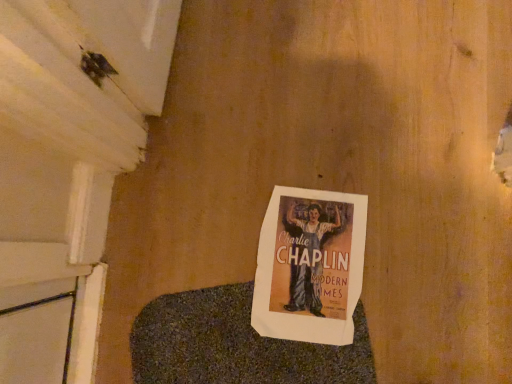
Image resolution: width=512 pixels, height=384 pixels. Describe the element at coordinates (310, 266) in the screenshot. I see `matte paper poster at center` at that location.

I want to click on matte paper poster at center, so click(310, 266).

In order to click on blue textured blanket at center in this screenshot , I will do `click(234, 345)`.

From the picture: In order to face blue textured blanket at center, should I rotate leftwards or rightwards?

To align with it, rotate left about 1.025°.

Describe the element at coordinates (234, 345) in the screenshot. I see `blue textured blanket at center` at that location.

Find the location of a particular element. This screenshot has width=512, height=384. matte paper poster at center is located at coordinates (310, 266).

Which is more to the left, blue textured blanket at center or matte paper poster at center?

blue textured blanket at center is more to the left.

Considering the positions of objects blue textured blanket at center and matte paper poster at center in the image provided, who is behind, blue textured blanket at center or matte paper poster at center?

matte paper poster at center.

Considering the points (269, 339) and (352, 268), which point is behind, point (269, 339) or point (352, 268)?

Positioned behind is point (352, 268).

From the image's perspective, between blue textured blanket at center and matte paper poster at center, who is located below?

blue textured blanket at center appears lower in the image.

From a real-world perspective, does blue textured blanket at center stand above matte paper poster at center?

Yes, from a real-world perspective, blue textured blanket at center is over matte paper poster at center

Based on the photo, considering the relative sizes of blue textured blanket at center and matte paper poster at center in the image provided, is blue textured blanket at center thinner than matte paper poster at center?

No, blue textured blanket at center is not thinner than matte paper poster at center.

From their relative heights in the image, would you say blue textured blanket at center is taller or shorter than matte paper poster at center?

blue textured blanket at center is taller than matte paper poster at center.

Can you confirm if blue textured blanket at center is bigger than matte paper poster at center?

Correct, blue textured blanket at center is larger in size than matte paper poster at center.

Is blue textured blanket at center not inside matte paper poster at center?

blue textured blanket at center is positioned outside matte paper poster at center.

Are blue textured blanket at center and matte paper poster at center located far from each other?

They are positioned close to each other.

Could you tell me if blue textured blanket at center is turned towards matte paper poster at center?

No, blue textured blanket at center does not turn towards matte paper poster at center.

Locate an element on the screen. Image resolution: width=512 pixels, height=384 pixels. blanket on the left side of matte paper poster at center is located at coordinates (234, 345).

Can you confirm if matte paper poster at center is positioned to the left of blue textured blanket at center?

Incorrect, matte paper poster at center is not on the left side of blue textured blanket at center.

Is matte paper poster at center closer to the viewer compared to blue textured blanket at center?

No, matte paper poster at center is behind blue textured blanket at center.

Is point (340, 340) closer or farther from the camera than point (236, 341)?

Point (340, 340) appears to be closer to the viewer than point (236, 341).

From the image's perspective, which is above, matte paper poster at center or blue textured blanket at center?

matte paper poster at center appears higher in the image.

From a real-world perspective, between matte paper poster at center and blue textured blanket at center, who is vertically lower?

In real-world perspective, matte paper poster at center is lower.

Considering the sizes of objects matte paper poster at center and blue textured blanket at center in the image provided, who is thinner, matte paper poster at center or blue textured blanket at center?

matte paper poster at center is thinner.

In terms of height, does matte paper poster at center look taller or shorter compared to blue textured blanket at center?

matte paper poster at center is shorter than blue textured blanket at center.

Considering the relative sizes of matte paper poster at center and blue textured blanket at center in the image provided, is matte paper poster at center smaller than blue textured blanket at center?

Yes, matte paper poster at center is smaller than blue textured blanket at center.

Is matte paper poster at center not inside blue textured blanket at center?

No, matte paper poster at center is not outside of blue textured blanket at center.

Are matte paper poster at center and blue textured blanket at center located far from each other?

No, matte paper poster at center is in close proximity to blue textured blanket at center.

Based on the photo, could you tell me if matte paper poster at center is turned towards blue textured blanket at center?

Yes, matte paper poster at center is oriented towards blue textured blanket at center.

This screenshot has height=384, width=512. I want to click on poster below the blue textured blanket at center (from a real-world perspective), so click(x=310, y=266).

Locate an element on the screen. This screenshot has height=384, width=512. poster above the blue textured blanket at center (from the image's perspective) is located at coordinates [x=310, y=266].

In the image, there is a blue textured blanket at center. Where is `poster below it (from a real-world perspective)`? poster below it (from a real-world perspective) is located at coordinates (310, 266).